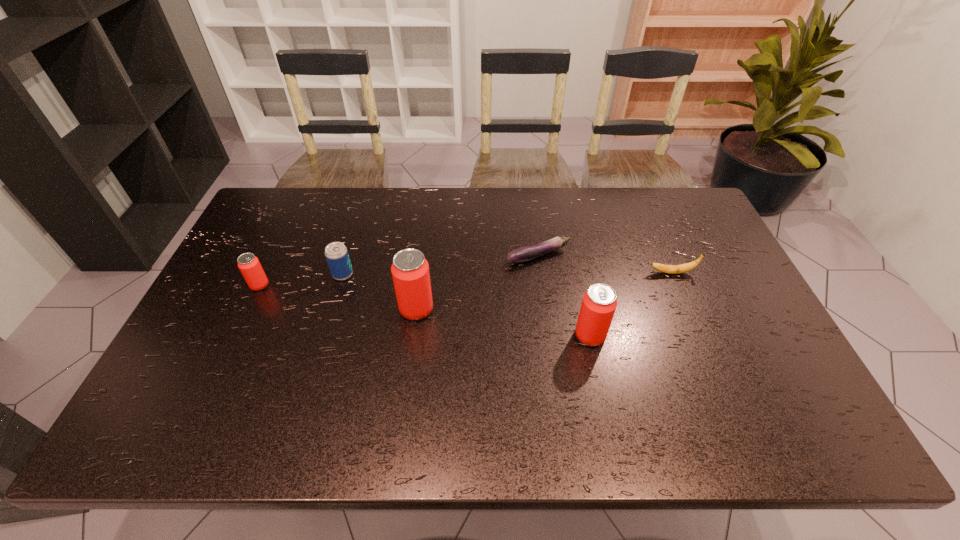
Please show where to add a beer can on the right while keeping spacing even. Please provide its 2D coordinates. Your answer should be formatted as a tuple, i.e. [(x, y)], where the tuple contains the x and y coordinates of a point satisfying the conditions above.

[(783, 365)]